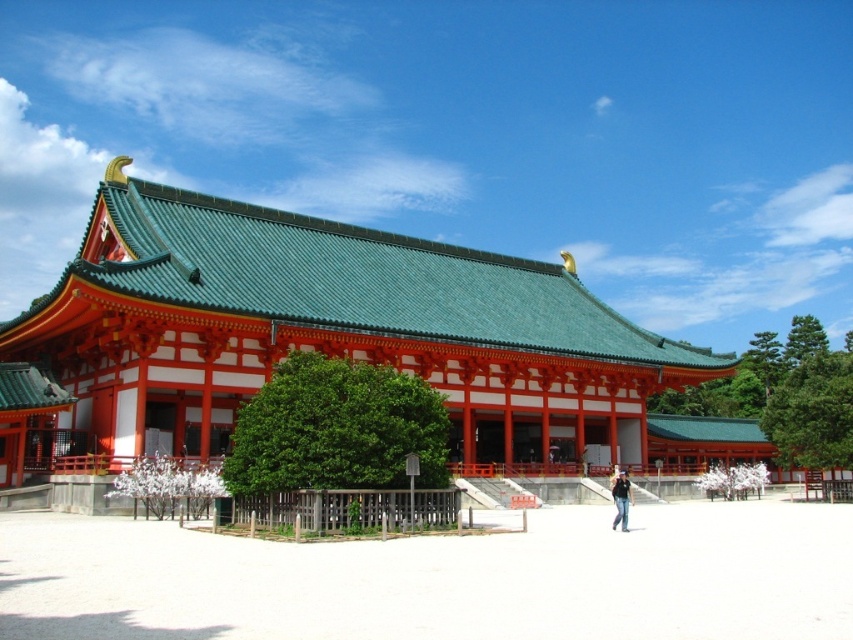
You are planning to place a new bench in the open area in front of the temple. The bench is 1.2 meters wide. You see the green leafy tree at center and the green leafy tree at right. Which tree has enough space between it and the bench if you place the bench next to it?

The green leafy tree at right has enough space because its width is greater than the green leafy tree at center, which is narrower. Since the bench is 1.2 meters wide, placing it next to the wider tree would provide more space.

You are standing in front of the traditional Japanese temple with red pillars and a green roof. You see a green leafy tree at center and black denim jeans at lower center. Which object is closer to you?

The green leafy tree at center is closer to you because it is in front of the black denim jeans at lower center.